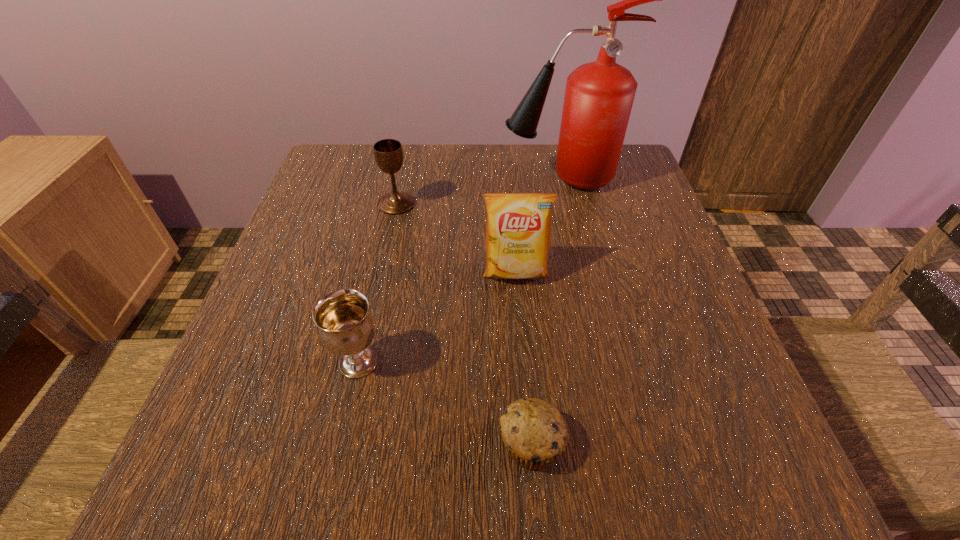
Find the location of `fire extinguisher`. fire extinguisher is located at coordinates (599, 95).

Locate an element on the screen. This screenshot has width=960, height=540. the third farthest object is located at coordinates (518, 231).

At what (x,y) coordinates should I click in order to perform the action: click on the farther chalice. Please return your answer as a coordinate pair (x, y). Looking at the image, I should click on (388, 153).

What are the coordinates of `the second nearest object` in the screenshot? It's located at (346, 327).

The width and height of the screenshot is (960, 540). Find the location of `the shortest object`. the shortest object is located at coordinates (534, 432).

Where is `the nearest object`? Image resolution: width=960 pixels, height=540 pixels. the nearest object is located at coordinates (534, 432).

Find the location of `free spot located 0.110m with the nozzle aimed from the fire extinguisher`. free spot located 0.110m with the nozzle aimed from the fire extinguisher is located at coordinates (458, 178).

Locate an element on the screen. The image size is (960, 540). vacant space located 0.230m with the nozzle aimed from the fire extinguisher is located at coordinates (409, 178).

Identify the location of vacant space located 0.160m with the nozzle aimed from the fire extinguisher. (438, 178).

Locate an element on the screen. The image size is (960, 540). vacant area situated 0.100m on the front-facing side of the crisp (potato chip) is located at coordinates (520, 330).